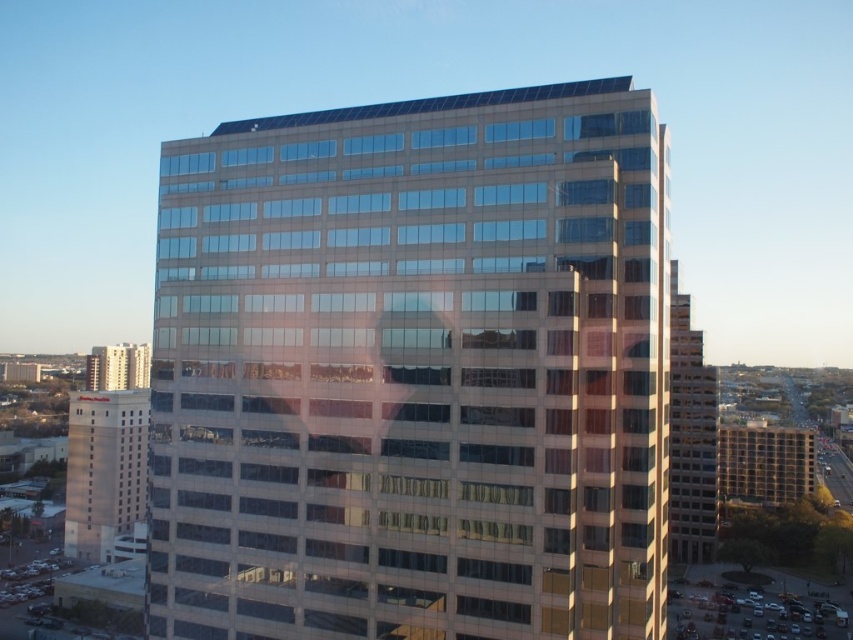
You are a drone operator who needs to deliver a package between the beige concrete building at right and the matte glass building at left. The drone has a maximum range of 300 meters. Can the drone successfully deliver the package between these two buildings?

The beige concrete building at right and the matte glass building at left are 291.40 meters apart from each other. Since the drone has a maximum range of 300 meters, it can successfully deliver the package between these two buildings as the distance is within its operational range.

You are standing in front of the modern multi story office building with a glass facade and you see the beige concrete hotel at lower left and the beige concrete building at right. Which one is located to the left of the other?

The beige concrete hotel at lower left is positioned on the left side of beige concrete building at right.